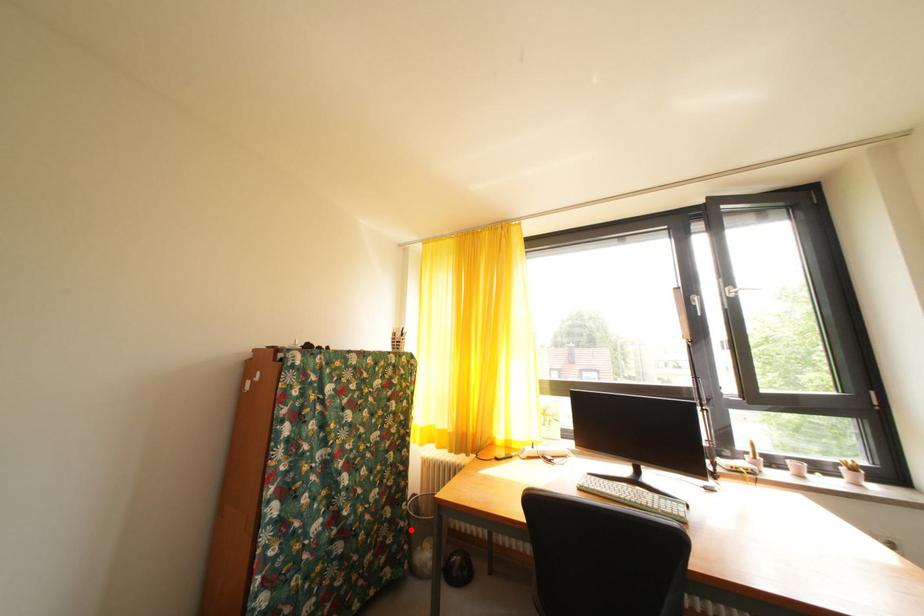
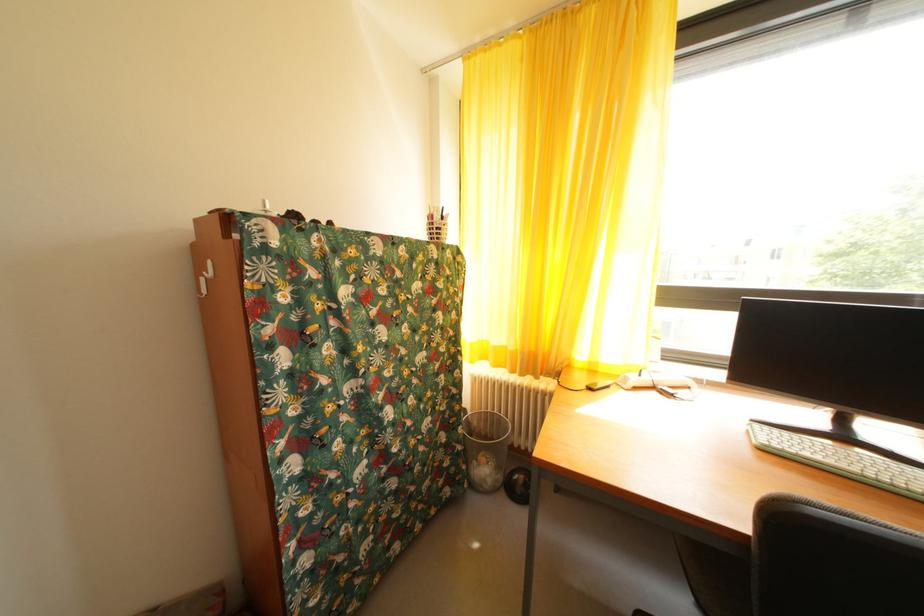
Question: I am providing you with two images of the same scene from different viewpoints. In image1, a red point is highlighted. Considering the same 3D point in image2, which of the following is correct?

Choices:
 (A) It is closer
 (B) It is farther

Answer: (A)